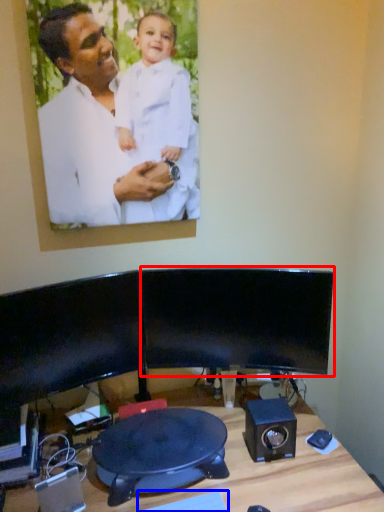
Question: Which of the following is the closest to the observer, computer monitor (highlighted by a red box) or keyboard (highlighted by a blue box)?

Choices:
 (A) computer monitor
 (B) keyboard

Answer: (B)